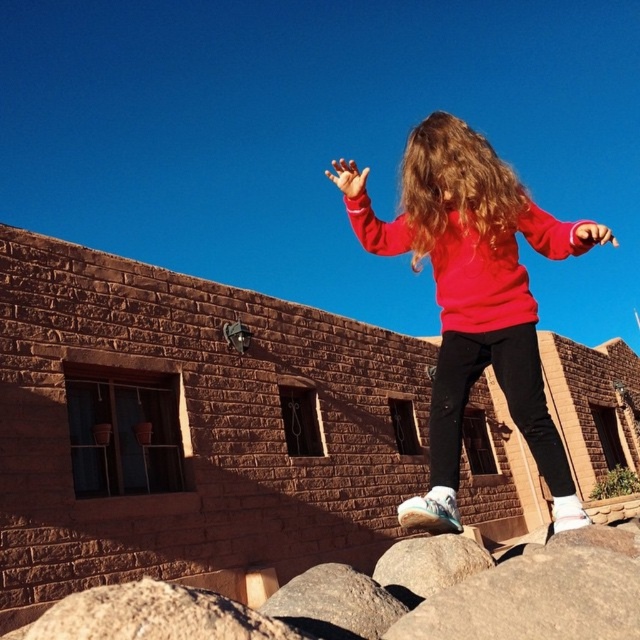
Question: Which object is the closest to the blonde silky hair at center?

Choices:
 (A) smooth orange hand at upper center
 (B) matte red sweatshirt at center
 (C) matte pink hand at upper right

Answer: (A)

Question: Is smooth orange hand at upper center wider than matte pink hand at upper right?

Choices:
 (A) yes
 (B) no

Answer: (B)

Question: From the image, what is the correct spatial relationship of smooth orange hand at upper center in relation to matte pink hand at upper right?

Choices:
 (A) above
 (B) below

Answer: (B)

Question: Is matte red sweatshirt at center below blonde silky hair at center?

Choices:
 (A) yes
 (B) no

Answer: (A)

Question: Which object appears farthest from the camera in this image?

Choices:
 (A) blonde silky hair at center
 (B) matte red sweatshirt at center

Answer: (A)

Question: Which of the following is the closest to the observer?

Choices:
 (A) smooth orange hand at upper center
 (B) blonde silky hair at center

Answer: (B)